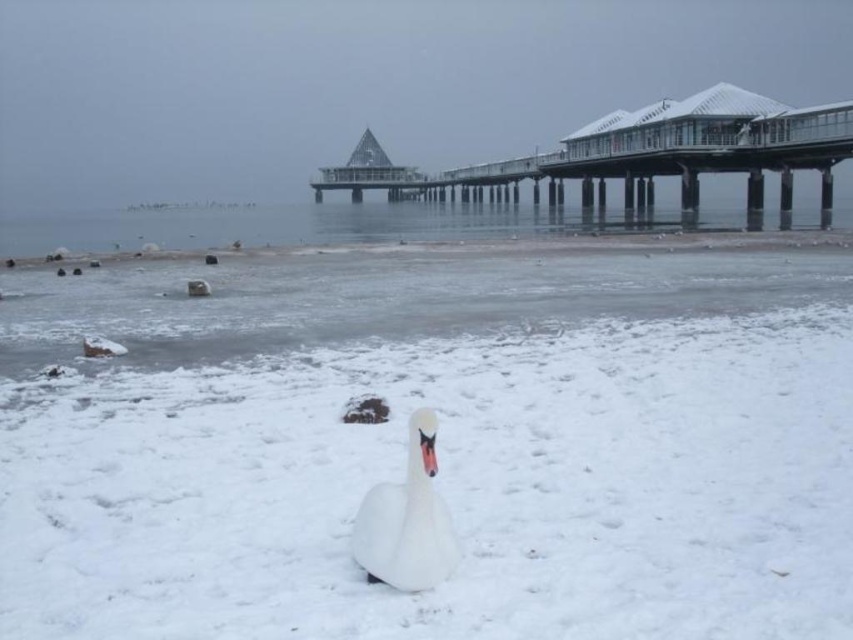
You are a photographer wanting to capture the clear glass pier at upper center and the clear ice water at center in the same frame. Which object will appear taller in the photo?

The clear glass pier at upper center is taller than the clear ice water at center, so it will appear taller in the photo.

You are a photographer aiming to capture the white matte swan at center and the clear ice water at center in a single shot. Which object will appear larger in your photo?

The clear ice water at center is much taller than the white matte swan at center, so it will appear larger in the photo.

You are a photographer standing at the edge of the frozen shoreline. You want to capture a photo of the clear glass pier at upper center. Based on its 2D coordinates, where should you position your camera to ensure the pier is centered in the frame?

The clear glass pier at upper center is located at coordinates point [637,156], so you should position your camera so that the pier is centered at those coordinates to capture it properly.